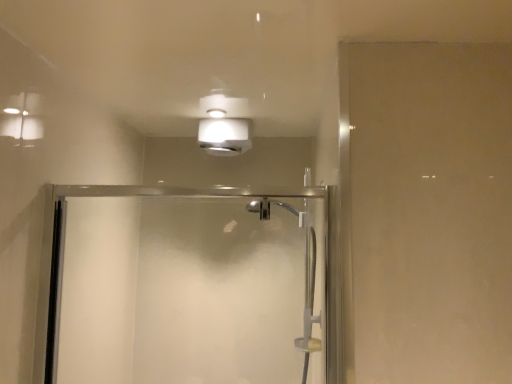
Question: Is clear glass shower door at center at the right side of white matte light fixture at upper center?

Choices:
 (A) no
 (B) yes

Answer: (A)

Question: From a real-world perspective, is clear glass shower door at center physically below white matte light fixture at upper center?

Choices:
 (A) no
 (B) yes

Answer: (B)

Question: From the image's perspective, does clear glass shower door at center appear lower than white matte light fixture at upper center?

Choices:
 (A) yes
 (B) no

Answer: (A)

Question: Does clear glass shower door at center lie in front of white matte light fixture at upper center?

Choices:
 (A) no
 (B) yes

Answer: (B)

Question: From a real-world perspective, is clear glass shower door at center positioned over white matte light fixture at upper center based on gravity?

Choices:
 (A) yes
 (B) no

Answer: (B)

Question: Can you confirm if clear glass shower door at center is positioned to the left of white matte light fixture at upper center?

Choices:
 (A) yes
 (B) no

Answer: (A)

Question: Is white matte light fixture at upper center facing away from clear glass shower door at center?

Choices:
 (A) yes
 (B) no

Answer: (B)

Question: Is white matte light fixture at upper center wider than clear glass shower door at center?

Choices:
 (A) yes
 (B) no

Answer: (A)

Question: From a real-world perspective, is white matte light fixture at upper center positioned over clear glass shower door at center based on gravity?

Choices:
 (A) yes
 (B) no

Answer: (A)

Question: Is white matte light fixture at upper center not within clear glass shower door at center?

Choices:
 (A) no
 (B) yes

Answer: (B)

Question: Is white matte light fixture at upper center in front of clear glass shower door at center?

Choices:
 (A) no
 (B) yes

Answer: (A)

Question: Could you tell me if white matte light fixture at upper center is facing clear glass shower door at center?

Choices:
 (A) no
 (B) yes

Answer: (A)

Question: In terms of height, does clear glass shower door at center look taller or shorter compared to white matte light fixture at upper center?

Choices:
 (A) tall
 (B) short

Answer: (A)